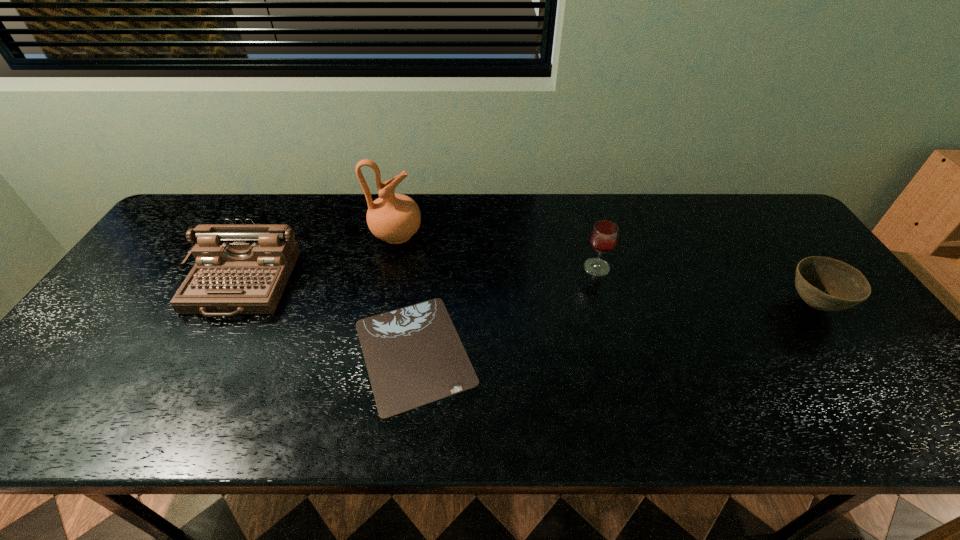
I want to click on vacant region located on the right of the mousepad, so click(575, 352).

Find the location of a particular element. object situated at the far edge is located at coordinates (395, 218).

Where is `object that is at the near edge`? object that is at the near edge is located at coordinates (414, 356).

This screenshot has height=540, width=960. Find the location of `object that is at the right edge`. object that is at the right edge is located at coordinates (827, 284).

Find the location of `vacant region at the far edge of the desktop`. vacant region at the far edge of the desktop is located at coordinates (532, 203).

The image size is (960, 540). Identify the location of free location at the near edge. (325, 422).

You are a GUI agent. You are given a task and a screenshot of the screen. Output one action in this format:
    pyautogui.click(x=<x>, y=<y>)
    Task: Click on the vacant space at the left edge of the desktop
    The height and width of the screenshot is (540, 960).
    Given the screenshot: What is the action you would take?
    pyautogui.click(x=74, y=362)

Locate an element on the screen. free space at the far right corner is located at coordinates (744, 225).

Identify the location of empty space that is in between the rightmost object and the wineglass. The image size is (960, 540). (705, 286).

Where is `free spot between the wineglass and the pottery`? free spot between the wineglass and the pottery is located at coordinates (496, 251).